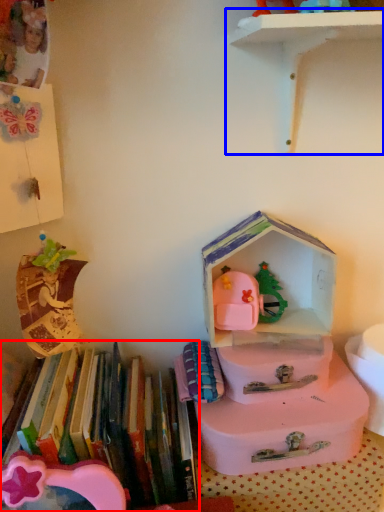
Question: Which point is closer to the camera, book (highlighted by a red box) or shelf (highlighted by a blue box)?

Choices:
 (A) book
 (B) shelf

Answer: (B)